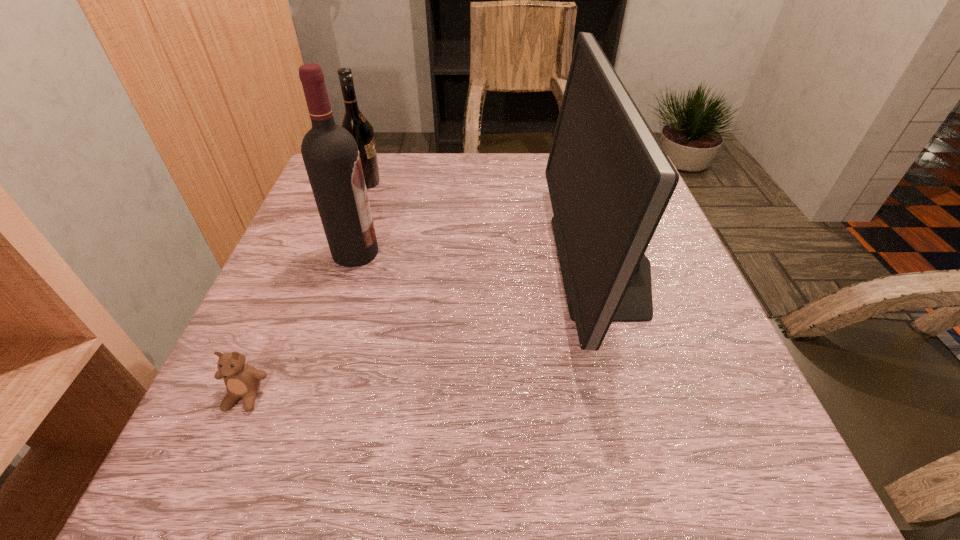
Find the location of `blank space at the left edge of the desktop`. blank space at the left edge of the desktop is located at coordinates (267, 279).

Locate an element on the screen. This screenshot has width=960, height=540. free location at the right edge is located at coordinates (683, 268).

Image resolution: width=960 pixels, height=540 pixels. In order to click on free space at the far left corner in this screenshot , I will do tap(382, 162).

Find the location of a particular element. The height and width of the screenshot is (540, 960). free space at the near left corner of the desktop is located at coordinates (190, 471).

Locate an element on the screen. Image resolution: width=960 pixels, height=540 pixels. vacant region between the taller wine bottle and the shortest object is located at coordinates (300, 325).

Locate an element on the screen. free space between the shortest object and the computer monitor is located at coordinates pos(423,330).

Locate an element on the screen. free space between the teddy bear and the computer monitor is located at coordinates pos(423,330).

Locate an element on the screen. vacant point located between the shortest object and the taller wine bottle is located at coordinates point(300,325).

Identify the location of vacant region between the taller wine bottle and the computer monitor. (479, 258).

This screenshot has height=540, width=960. What are the coordinates of `vacant point located between the second shortest object and the computer monitor` in the screenshot? It's located at (485, 223).